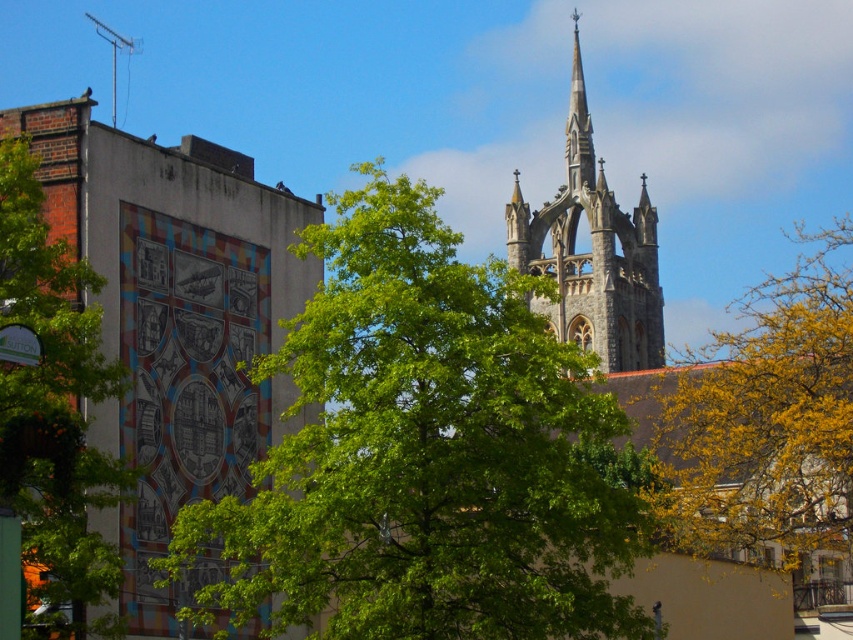
Is point (80, 477) positioned before point (614, 273)?

Yes, it is in front of point (614, 273).

Who is more forward, [99,589] or [595,189]?

Point [99,589] is more forward.

Image resolution: width=853 pixels, height=640 pixels. What are the coordinates of `green leafy tree at left` in the screenshot? It's located at (53, 406).

Who is positioned more to the left, green leafy tree at center or yellow leafy tree at center?

green leafy tree at center

Is point (314, 454) positioned after point (791, 353)?

No, it is in front of (791, 353).

Which is behind, point (431, 508) or point (807, 365)?

Positioned behind is point (807, 365).

Identify the location of green leafy tree at center. (427, 452).

Is green leafy tree at center shorter than green leafy tree at left?

In fact, green leafy tree at center may be taller than green leafy tree at left.

Which is behind, point (386, 333) or point (45, 305)?

The point (386, 333) is behind.

The width and height of the screenshot is (853, 640). Find the location of `green leafy tree at center`. green leafy tree at center is located at coordinates (427, 452).